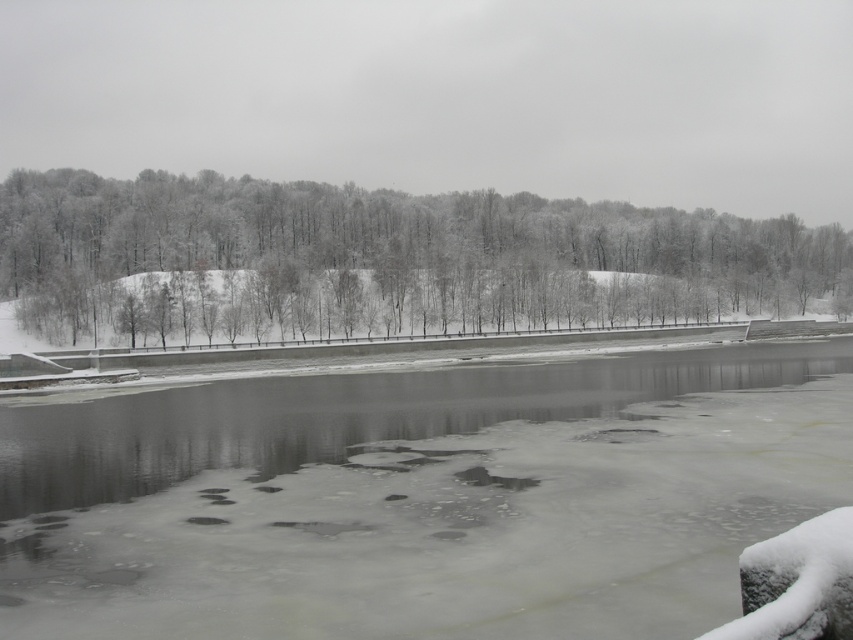
Question: Is frozen ice at center positioned at the back of white frosty trees at upper left?

Choices:
 (A) no
 (B) yes

Answer: (A)

Question: Which point is closer to the camera taking this photo?

Choices:
 (A) (0, 209)
 (B) (518, 397)

Answer: (B)

Question: Does frozen ice at center have a lesser width compared to white frosty trees at upper left?

Choices:
 (A) no
 (B) yes

Answer: (B)

Question: Among these objects, which one is farthest from the camera?

Choices:
 (A) white frosty trees at upper left
 (B) frozen ice at center

Answer: (A)

Question: Which point is closer to the camera taking this photo?

Choices:
 (A) (136, 474)
 (B) (555, 294)

Answer: (A)

Question: Does frozen ice at center come behind white frosty trees at upper left?

Choices:
 (A) yes
 (B) no

Answer: (B)